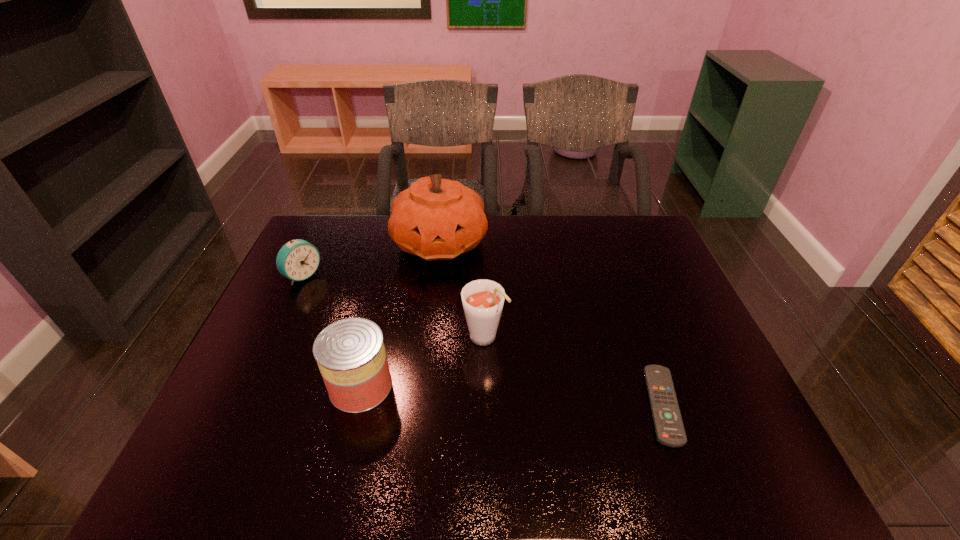
Where is `vacant space that satisfies the following two spatial constraints: 1. on the front side of the rightmost object; 2. on the left side of the root beer`? vacant space that satisfies the following two spatial constraints: 1. on the front side of the rightmost object; 2. on the left side of the root beer is located at coordinates (485, 405).